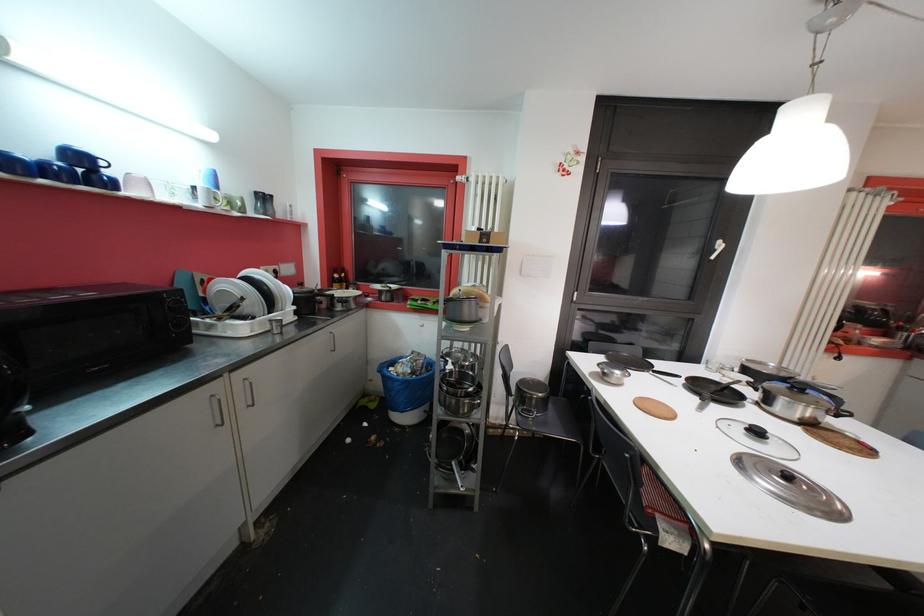
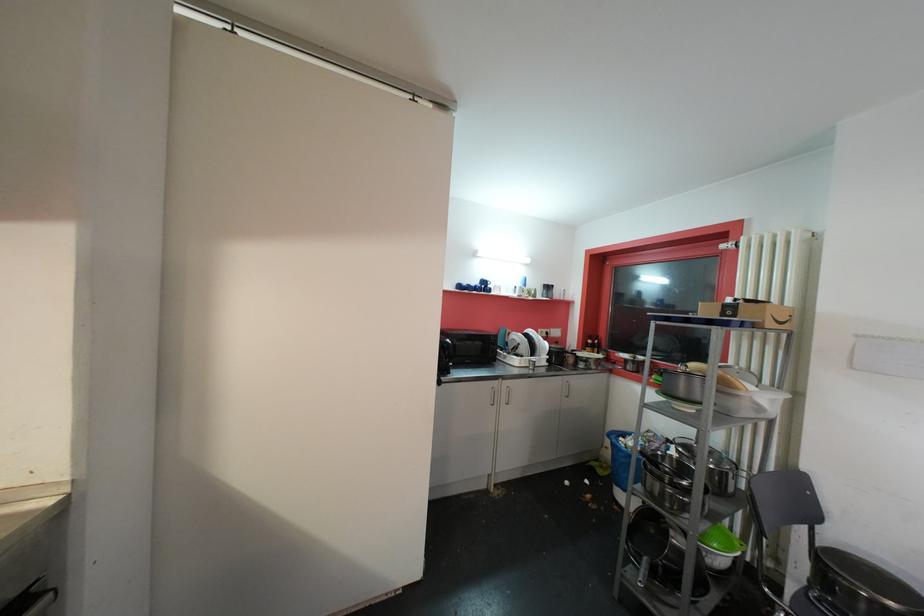
Where in the second image is the point corresponding to point 393,377 from the first image?

(619, 443)